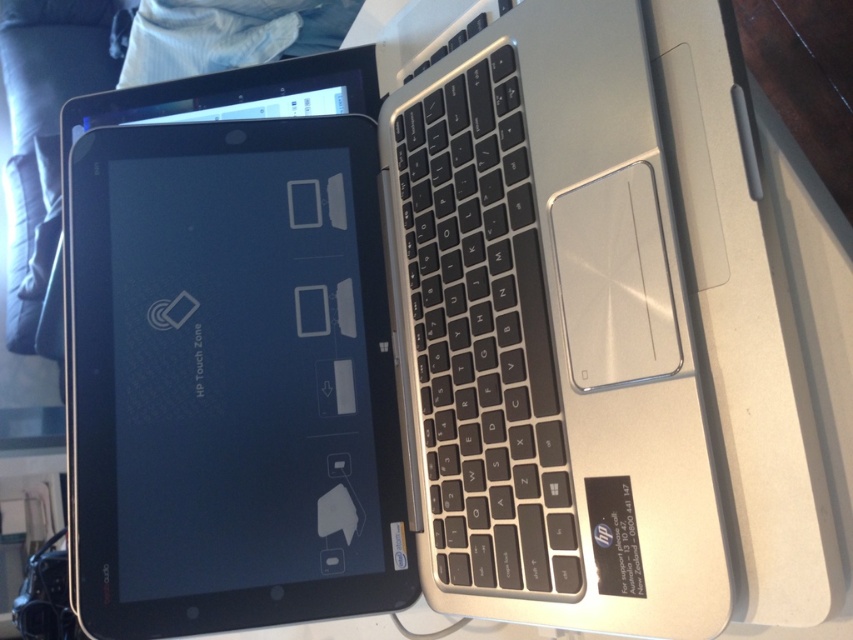
Question: Is black glossy tablet at center above black matte keyboard at center?

Choices:
 (A) no
 (B) yes

Answer: (A)

Question: Does black glossy tablet at center appear under black matte keyboard at center?

Choices:
 (A) yes
 (B) no

Answer: (A)

Question: Among these points, which one is farthest from the camera?

Choices:
 (A) (454, 410)
 (B) (334, 509)

Answer: (B)

Question: Is black glossy tablet at center to the left of black matte keyboard at center from the viewer's perspective?

Choices:
 (A) no
 (B) yes

Answer: (B)

Question: Which object appears closest to the camera in this image?

Choices:
 (A) black matte keyboard at center
 (B) black glossy tablet at center

Answer: (A)